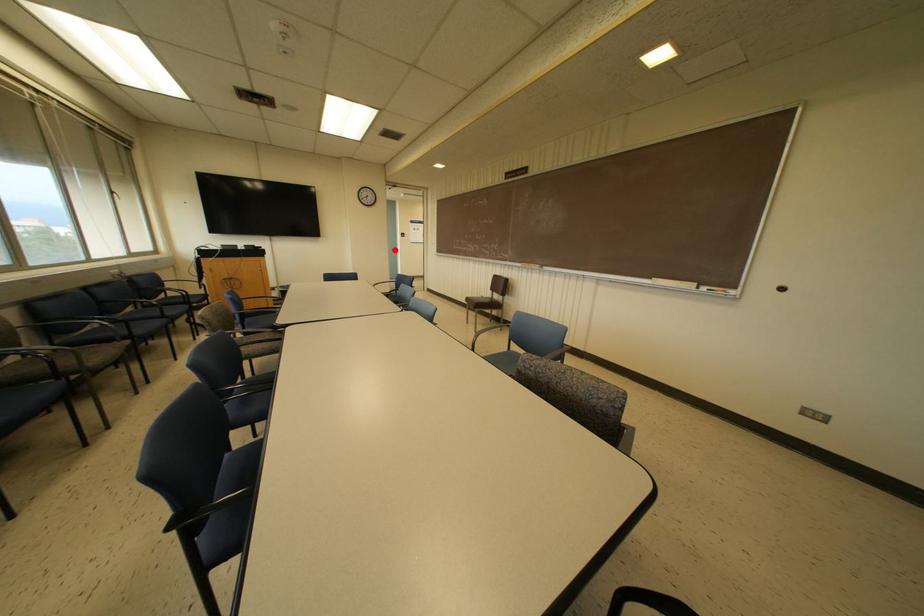
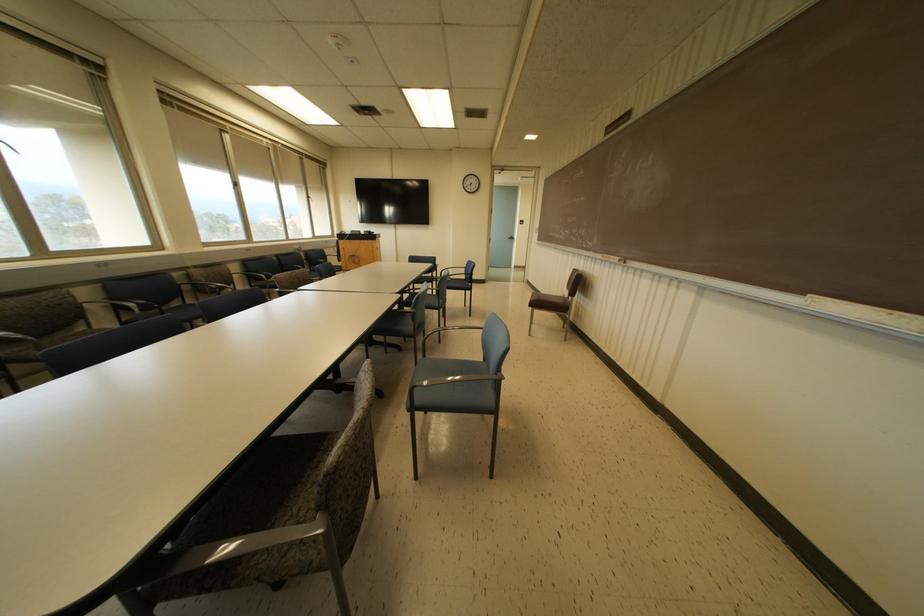
Question: A red point is marked in image1. In image2, is the corresponding 3D point closer to the camera or farther? Reply with the corresponding letter.

Choices:
 (A) The corresponding 3D point is closer.
 (B) The corresponding 3D point is farther.

Answer: (A)